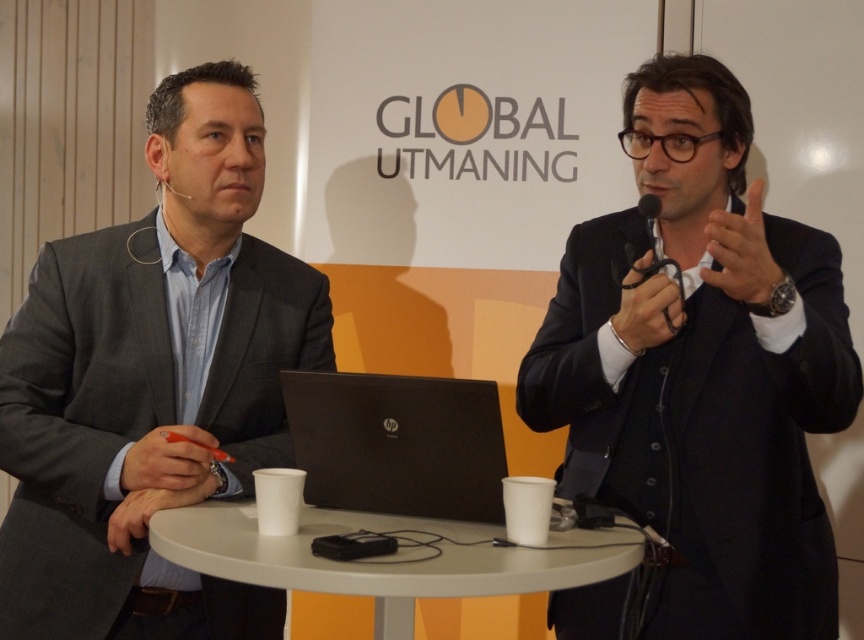
Is point (187, 243) behind point (251, 550)?

Yes, point (187, 243) is farther from viewer.

You are a GUI agent. You are given a task and a screenshot of the screen. Output one action in this format:
    pyautogui.click(x=<x>, y=<y>)
    Task: Click on the gray suit at left
    Image resolution: width=864 pixels, height=640 pixels.
    Given the screenshot: What is the action you would take?
    pyautogui.click(x=151, y=381)

From the picture: Does black leather microphone at center appear under matte orange pen at lower left?

Incorrect, black leather microphone at center is not positioned below matte orange pen at lower left.

Does black leather microphone at center come behind matte orange pen at lower left?

Yes, black leather microphone at center is behind matte orange pen at lower left.

Does point (626, 305) come behind point (145, 472)?

Yes, it is.

What are the coordinates of `black leather microphone at center` in the screenshot? It's located at (648, 307).

Is gray suit at left bigger than matte black hand at upper right?

Yes, gray suit at left is bigger than matte black hand at upper right.

Is point (71, 372) less distant than point (746, 269)?

No, it is behind (746, 269).

What do you see at coordinates (151, 381) in the screenshot? I see `gray suit at left` at bounding box center [151, 381].

At what (x,y) coordinates should I click in order to perform the action: click on gray suit at left. Please return your answer as a coordinate pair (x, y). The image size is (864, 640). Looking at the image, I should click on (151, 381).